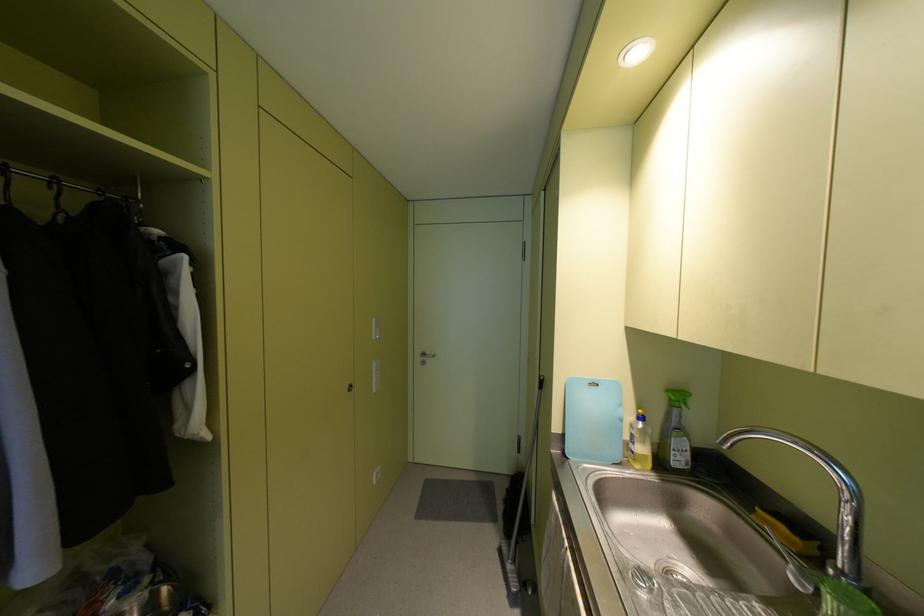
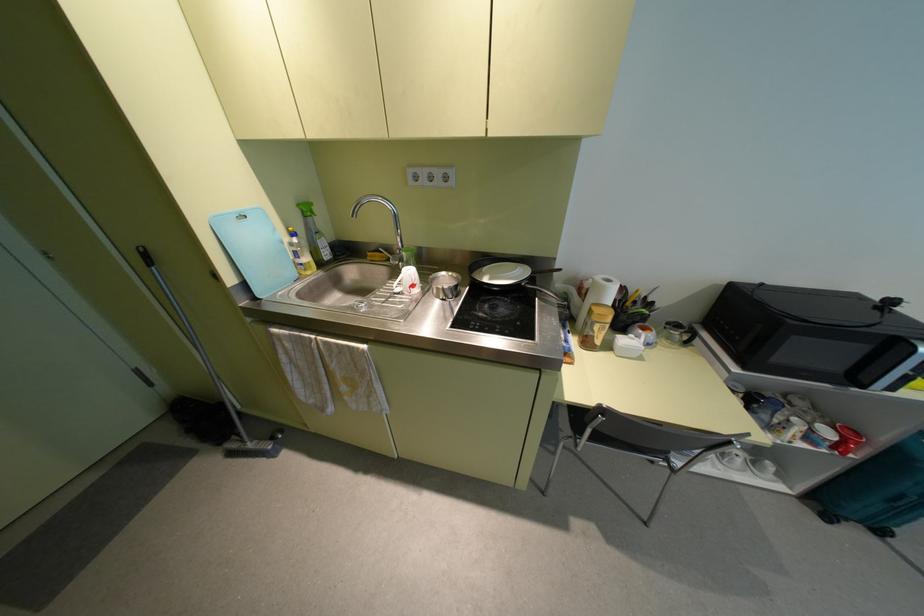
In the second image, find the point that corresponds to the point at 507,565 in the first image.

(250, 445)